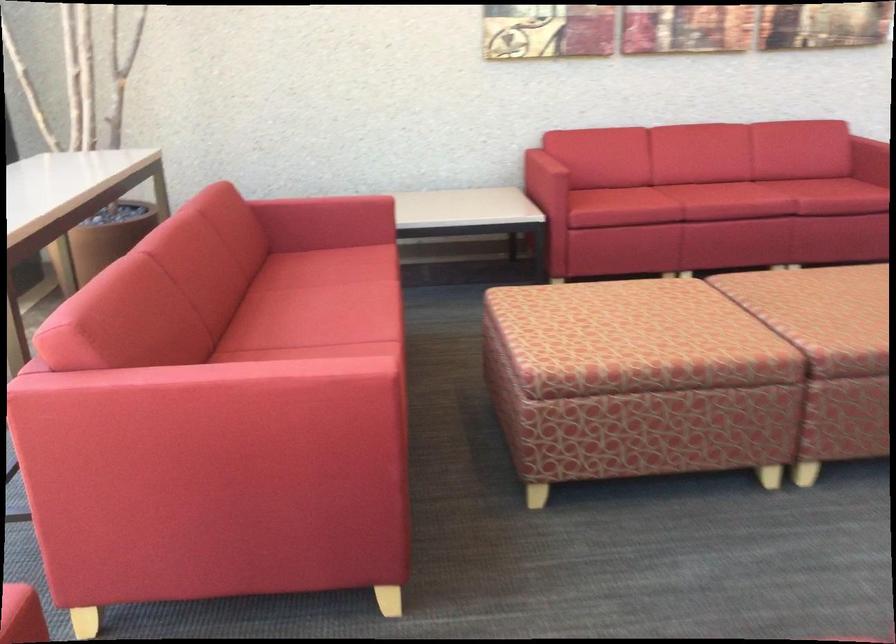
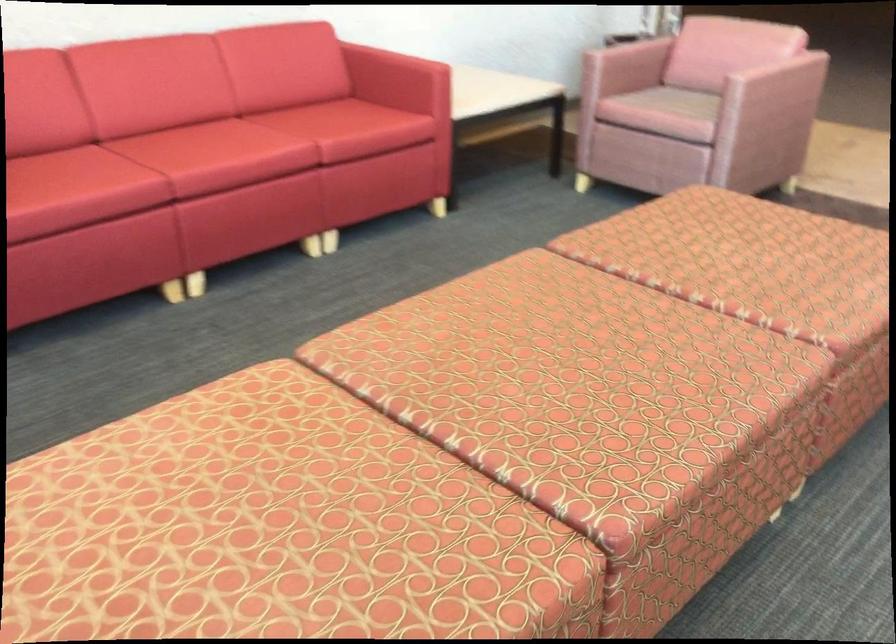
Find the pixel in the second image that matches [652,308] in the first image.

(250, 522)